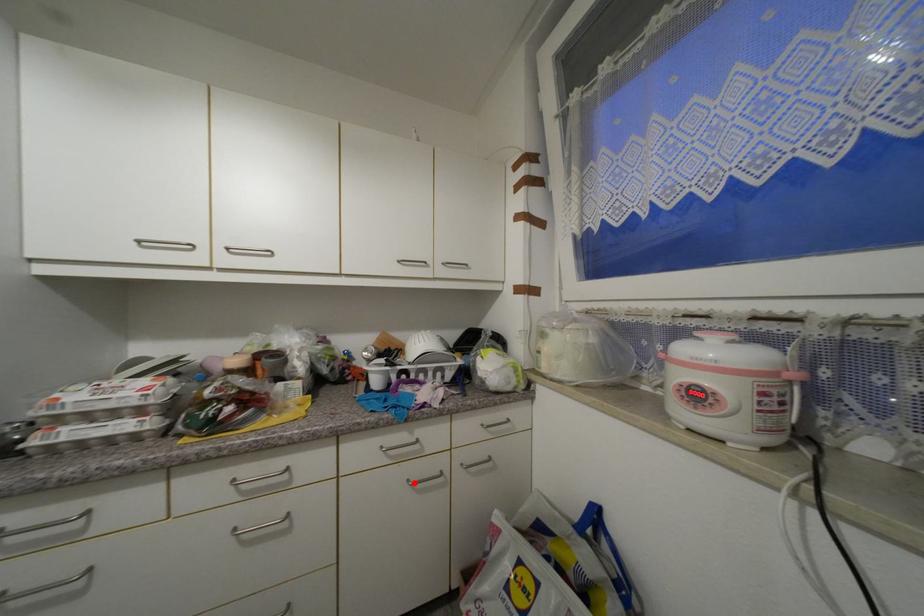
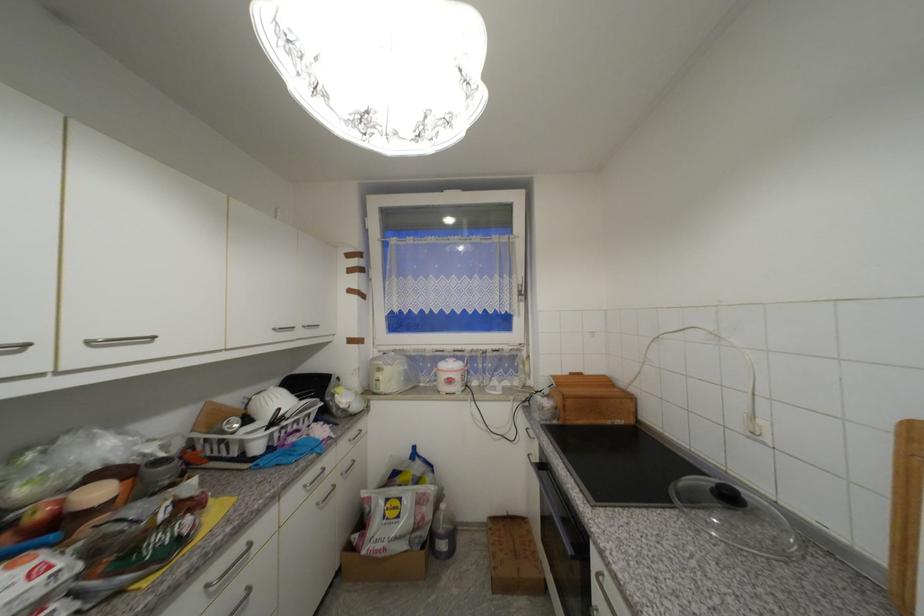
Question: A red point is marked in image1. In image2, is the corresponding 3D point closer to the camera or farther? Reply with the corresponding letter.

Choices:
 (A) The corresponding 3D point is closer.
 (B) The corresponding 3D point is farther.

Answer: (A)